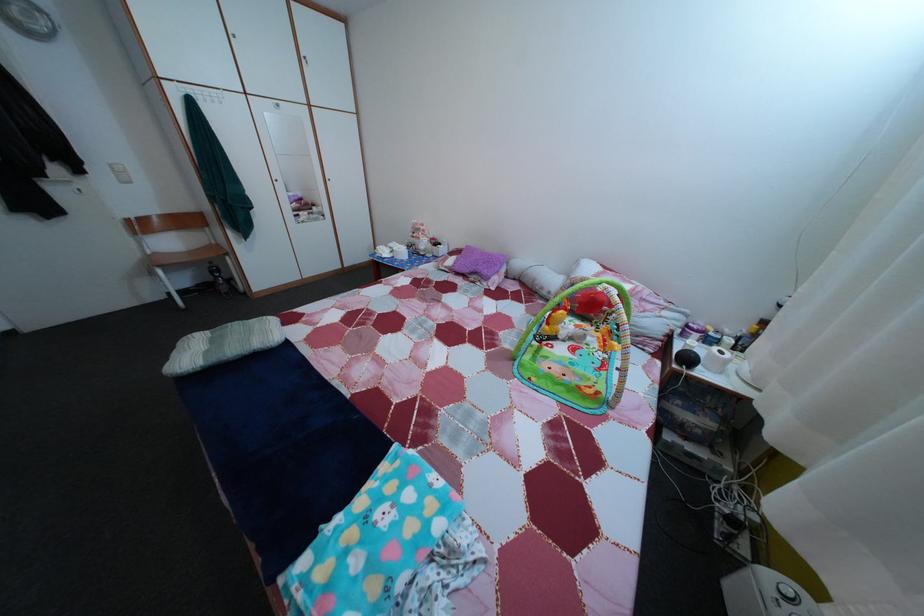
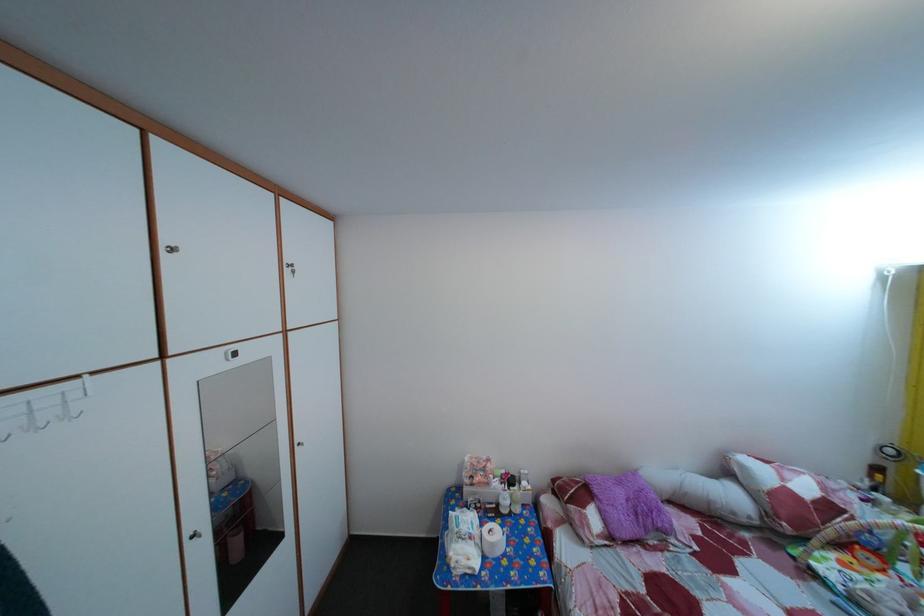
Where in the second image is the point corresponding to the point at 492,261 from the first image?

(629, 491)